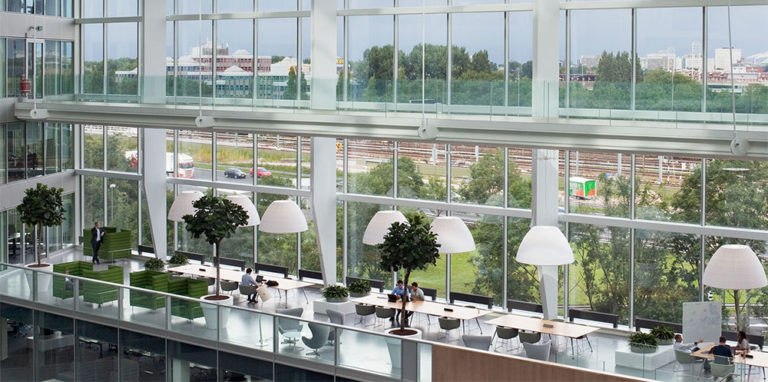
Locate an element on the screen. The height and width of the screenshot is (382, 768). lamps is located at coordinates (x=180, y=199), (x=250, y=205), (x=283, y=215), (x=376, y=223), (x=452, y=230), (x=545, y=250).